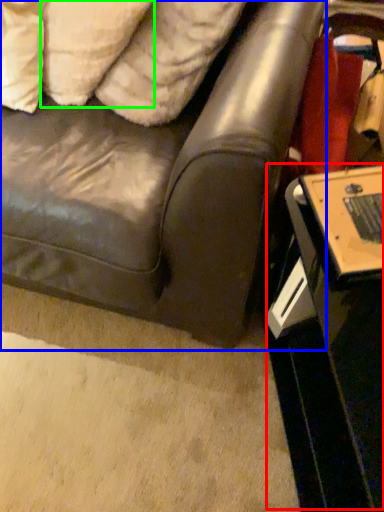
Question: Estimate the real-world distances between objects in this image. Which object is farther from table (highlighted by a red box), studio couch (highlighted by a blue box) or pillow (highlighted by a green box)?

Choices:
 (A) studio couch
 (B) pillow

Answer: (B)